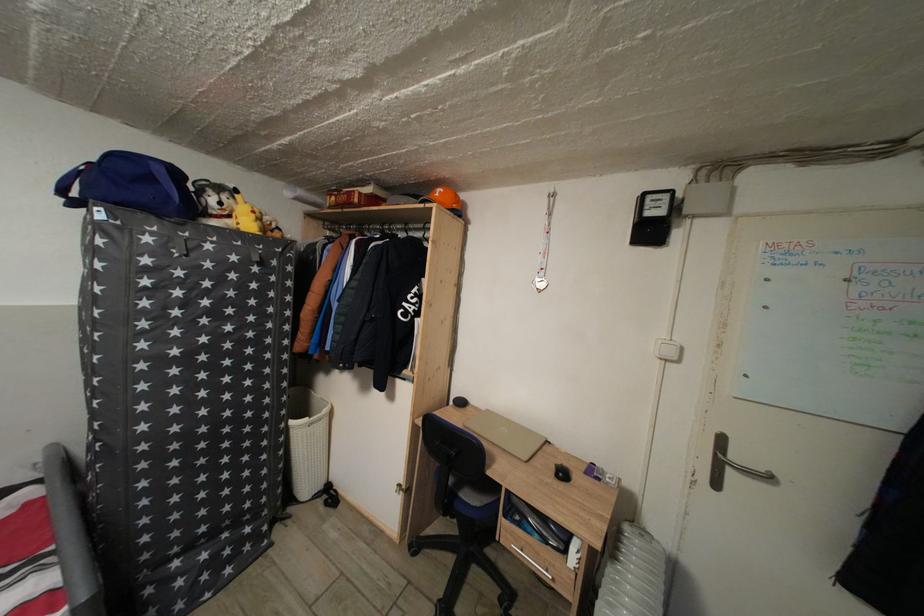
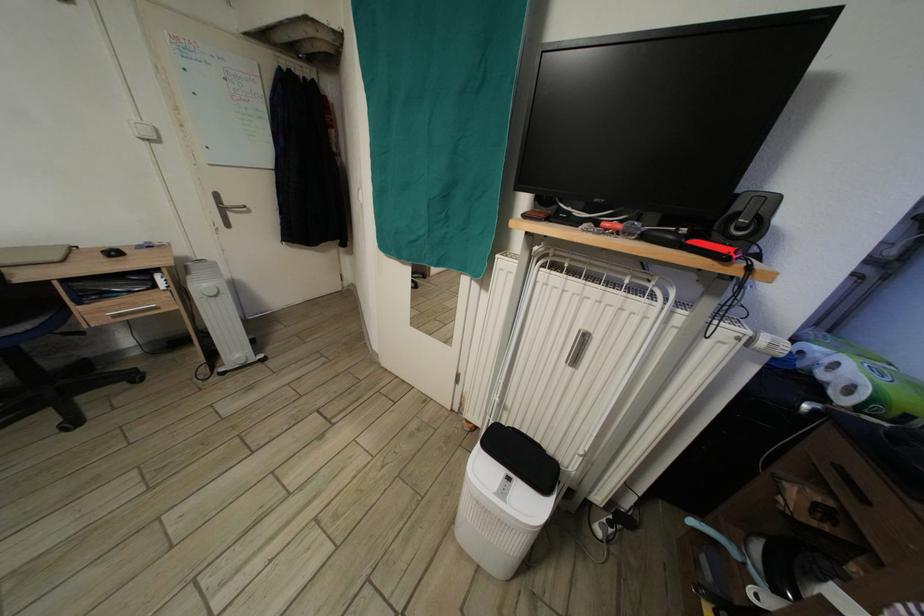
Where in the second image is the point corresponding to point (672, 342) from the first image?

(141, 124)